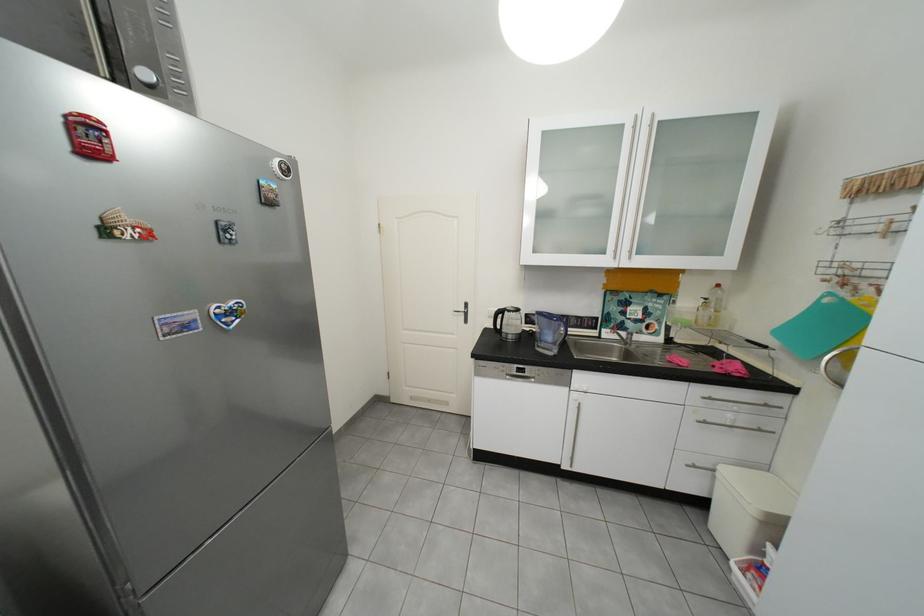
This screenshot has height=616, width=924. I want to click on silver door handle, so click(463, 312).